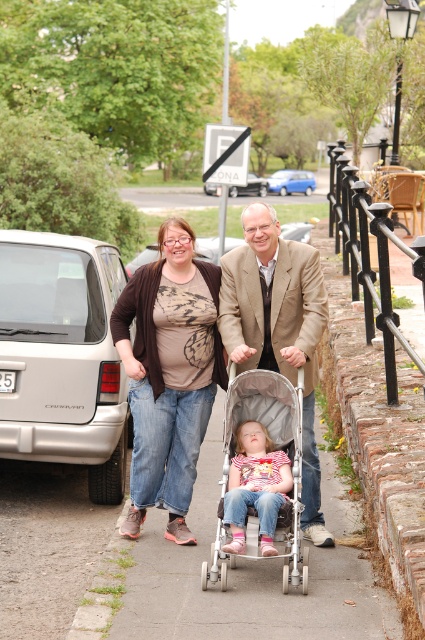
Who is taller, tan woolen suit at center or silver metallic sedan at center?

silver metallic sedan at center

Is tan woolen suit at center bigger than silver metallic sedan at center?

No, tan woolen suit at center is not bigger than silver metallic sedan at center.

Where is `tan woolen suit at center`? The width and height of the screenshot is (425, 640). tan woolen suit at center is located at coordinates (277, 328).

Between blue metallic car at center and silver metallic sedan at center, which one is positioned higher?

blue metallic car at center is above.

Between point (312, 173) and point (234, 195), which one is positioned behind?

Point (312, 173)

Between point (268, 180) and point (206, 182), which one is positioned behind?

Positioned behind is point (268, 180).

Locate an element on the screen. This screenshot has width=425, height=640. blue metallic car at center is located at coordinates (291, 180).

Which is in front, point (266, 467) or point (238, 189)?

Positioned in front is point (266, 467).

Does matte pink shirt at center have a larger size compared to silver metallic sedan at center?

Incorrect, matte pink shirt at center is not larger than silver metallic sedan at center.

Which is in front, point (234, 484) or point (209, 186)?

Point (234, 484)

This screenshot has width=425, height=640. I want to click on matte pink shirt at center, so click(x=255, y=486).